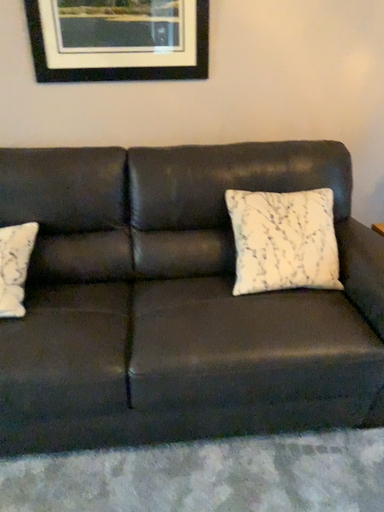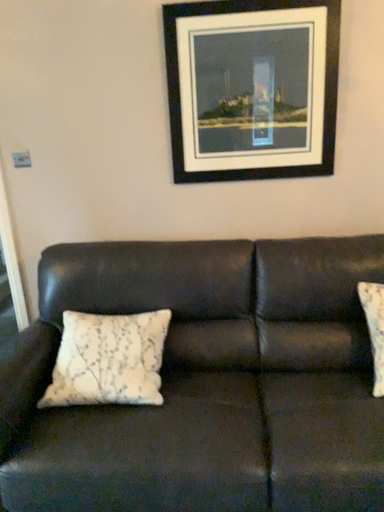
Question: How did the camera likely rotate when shooting the video?

Choices:
 (A) rotated upward
 (B) rotated downward

Answer: (A)